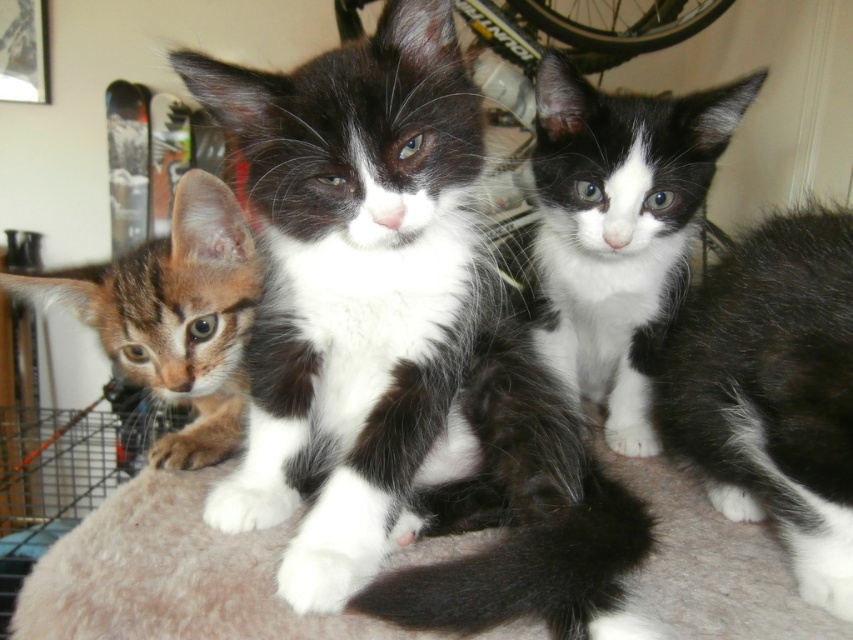
Is black and white fur at center positioned before tabby fur kitten at left?

Yes.

Can you confirm if black and white fur at center is bigger than tabby fur kitten at left?

Correct, black and white fur at center is larger in size than tabby fur kitten at left.

Find the location of a particular element. The image size is (853, 640). black and white fur at center is located at coordinates (772, 392).

This screenshot has height=640, width=853. What are the coordinates of `black and white fur at center` in the screenshot? It's located at (772, 392).

Who is positioned more to the left, black and white fur cat at center or white soft fur kitten at center?

From the viewer's perspective, black and white fur cat at center appears more on the left side.

Can you confirm if black and white fur cat at center is bigger than white soft fur kitten at center?

Yes, black and white fur cat at center is bigger than white soft fur kitten at center.

Is point (469, 332) positioned in front of point (538, 128)?

Yes, it is.

This screenshot has width=853, height=640. What are the coordinates of `black and white fur cat at center` in the screenshot? It's located at (403, 355).

From the picture: Does white soft fur kitten at center have a lesser width compared to tabby fur kitten at left?

No.

Does white soft fur kitten at center have a greater width compared to tabby fur kitten at left?

Yes.

Who is more forward, (650, 301) or (161, 449)?

Point (161, 449) is in front.

Identify the location of white soft fur kitten at center. [618, 228].